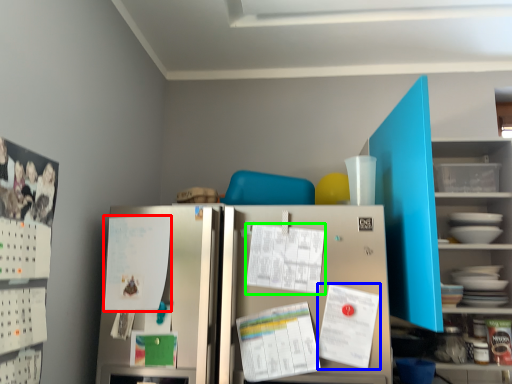
Question: Considering the real-world distances, which object is farthest from paper (highlighted by a red box)? paper (highlighted by a blue box) or paper (highlighted by a green box)?

Choices:
 (A) paper
 (B) paper

Answer: (A)